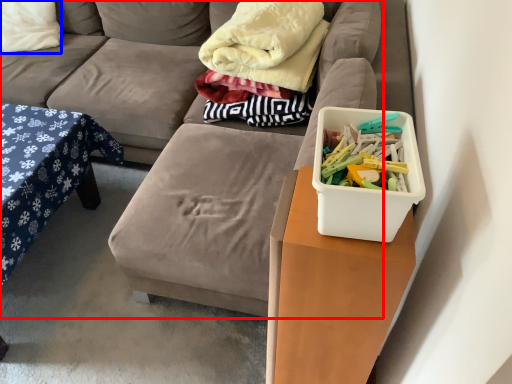
Question: Which object appears farthest to the camera in this image, studio couch (highlighted by a red box) or pillow (highlighted by a blue box)?

Choices:
 (A) studio couch
 (B) pillow

Answer: (B)